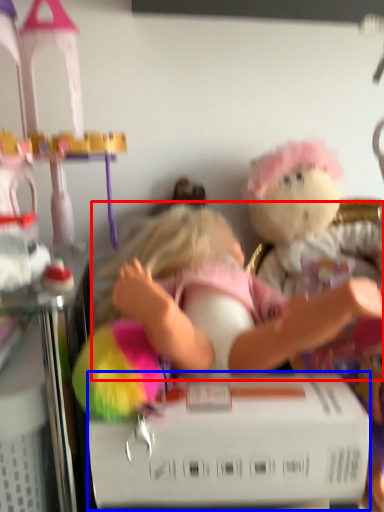
Question: Which point is further to the camera, person (highlighted by a red box) or box (highlighted by a blue box)?

Choices:
 (A) person
 (B) box

Answer: (A)